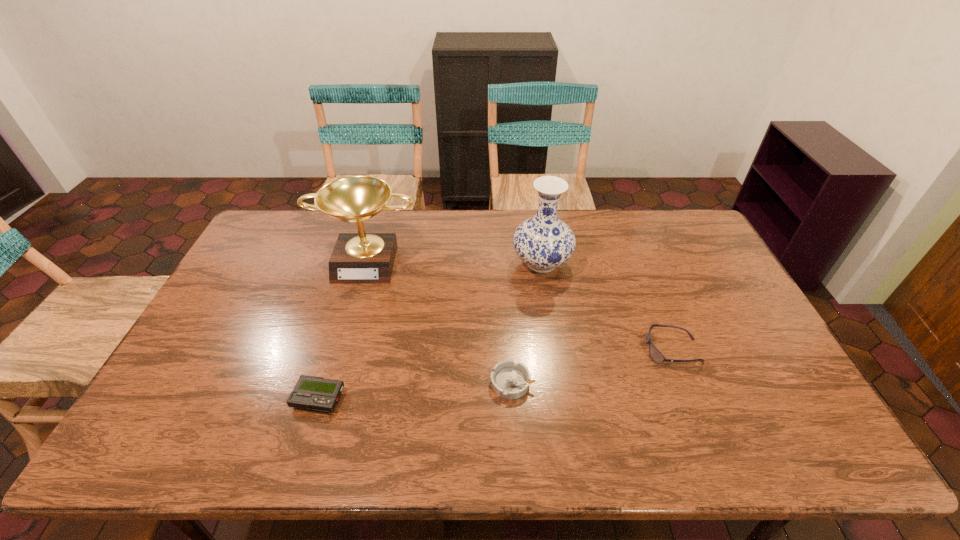
At what (x,y) coordinates should I click in order to perform the action: click on free space at the far right corner. Please return your answer as a coordinate pair (x, y). This screenshot has width=960, height=540. Looking at the image, I should click on (682, 227).

I want to click on vacant area that lies between the tallest object and the award, so click(454, 261).

I want to click on free space that is in between the fourth shortest object and the rightmost object, so click(x=520, y=305).

I want to click on free area in between the fourth shortest object and the vase, so coord(454,261).

Find the location of a particular element. This screenshot has height=540, width=960. vacant space that's between the vase and the beeper is located at coordinates (430, 330).

Where is `free space between the beeper and the ashtray`? The width and height of the screenshot is (960, 540). free space between the beeper and the ashtray is located at coordinates (416, 390).

Where is `free spot between the ashtray and the beeper`? The width and height of the screenshot is (960, 540). free spot between the ashtray and the beeper is located at coordinates (416, 390).

Where is `free point between the award and the sunglasses`? The width and height of the screenshot is (960, 540). free point between the award and the sunglasses is located at coordinates (520, 305).

The image size is (960, 540). What are the coordinates of `free space between the beeper and the ashtray` in the screenshot? It's located at (416, 390).

Select which object is the fourth closest to the fourth shortest object. Please provide its 2D coordinates. Your answer should be formatted as a tuple, i.e. [(x, y)], where the tuple contains the x and y coordinates of a point satisfying the conditions above.

[(654, 353)]